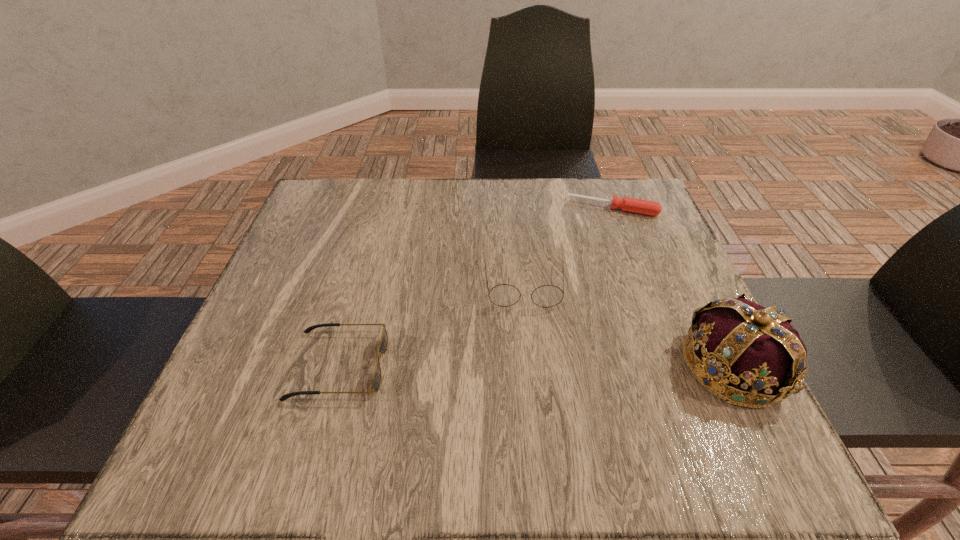
The image size is (960, 540). Identify the location of free space on the desktop that is between the leftmost object and the crown and is positioned at the blade of the farthest object. (586, 366).

Identify the location of free space on the desktop that is between the leftmost object and the crown and is positioned on the temples of the third shortest object. This screenshot has width=960, height=540. (530, 366).